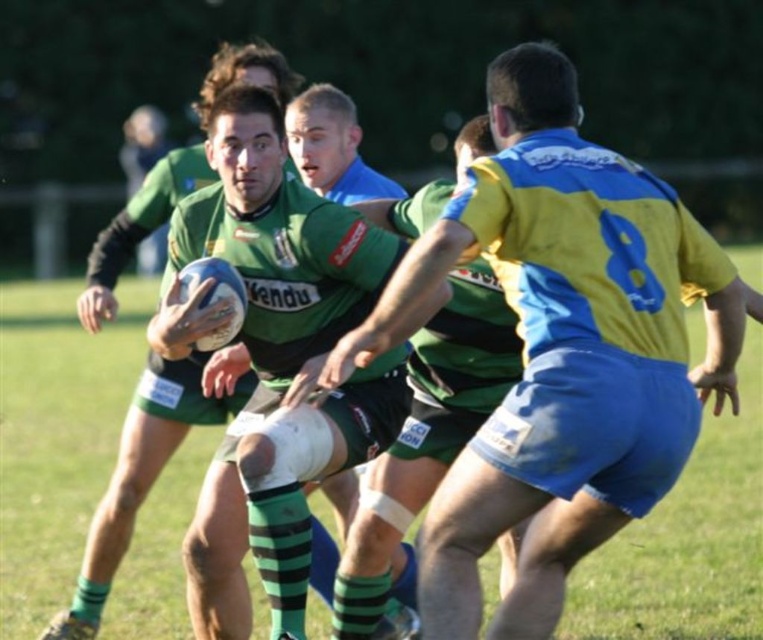
Which of these two, yellow-blue jersey at right or green matte jersey at center, stands shorter?

Standing shorter between the two is green matte jersey at center.

Identify the location of yellow-blue jersey at right. The image size is (763, 640). (572, 353).

This screenshot has width=763, height=640. Identify the location of yellow-blue jersey at right. (572, 353).